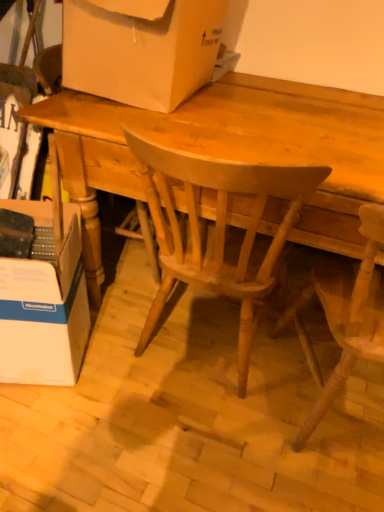
Question: Does wooden chair at center, arranged as the first chair when viewed from the right, have a lesser width compared to matte cardboard box at upper center, which is the first box in top-to-bottom order?

Choices:
 (A) yes
 (B) no

Answer: (B)

Question: Could you tell me if wooden chair at center, which appears as the second chair when viewed from the left, is turned towards matte cardboard box at upper center, which is the first box in top-to-bottom order?

Choices:
 (A) yes
 (B) no

Answer: (B)

Question: Is wooden chair at center, arranged as the first chair when viewed from the right, positioned behind matte cardboard box at upper center, which is the first box in top-to-bottom order?

Choices:
 (A) no
 (B) yes

Answer: (A)

Question: From the image's perspective, would you say wooden chair at center, which appears as the second chair when viewed from the left, is shown under matte cardboard box at upper center, which is the first box in top-to-bottom order?

Choices:
 (A) no
 (B) yes

Answer: (B)

Question: Is wooden chair at center, which appears as the second chair when viewed from the left, facing away from matte cardboard box at upper center, which is the first box in top-to-bottom order?

Choices:
 (A) yes
 (B) no

Answer: (B)

Question: Is point (276, 187) positioned closer to the camera than point (82, 64)?

Choices:
 (A) farther
 (B) closer

Answer: (B)

Question: From the image's perspective, is light brown wood chair at center, which appears as the second chair when viewed from the right, above or below matte cardboard box at upper center, which is the first box in top-to-bottom order?

Choices:
 (A) above
 (B) below

Answer: (B)

Question: Do you think light brown wood chair at center, the first chair viewed from the left, is within matte cardboard box at upper center, which is the first box in top-to-bottom order, or outside of it?

Choices:
 (A) outside
 (B) inside

Answer: (A)

Question: In the image, is light brown wood chair at center, which appears as the second chair when viewed from the right, positioned in front of or behind matte cardboard box at upper center, which is the first box in top-to-bottom order?

Choices:
 (A) front
 (B) behind

Answer: (A)

Question: From a real-world perspective, is matte cardboard box at upper center, which is the first box in top-to-bottom order, physically located above or below wooden chair at center, which appears as the second chair when viewed from the left?

Choices:
 (A) below
 (B) above

Answer: (B)

Question: From the image's perspective, relative to wooden chair at center, arranged as the first chair when viewed from the right, is matte cardboard box at upper center, acting as the second box starting from the bottom, above or below?

Choices:
 (A) below
 (B) above

Answer: (B)

Question: Is matte cardboard box at upper center, acting as the second box starting from the bottom, in front of or behind wooden chair at center, arranged as the first chair when viewed from the right, in the image?

Choices:
 (A) front
 (B) behind

Answer: (B)

Question: Would you say matte cardboard box at upper center, which is the first box in top-to-bottom order, is inside or outside wooden chair at center, arranged as the first chair when viewed from the right?

Choices:
 (A) outside
 (B) inside

Answer: (A)

Question: Is point (278, 237) closer or farther from the camera than point (340, 328)?

Choices:
 (A) closer
 (B) farther

Answer: (A)

Question: Is light brown wood chair at center, the first chair viewed from the left, bigger or smaller than wooden chair at center, which appears as the second chair when viewed from the left?

Choices:
 (A) small
 (B) big

Answer: (B)